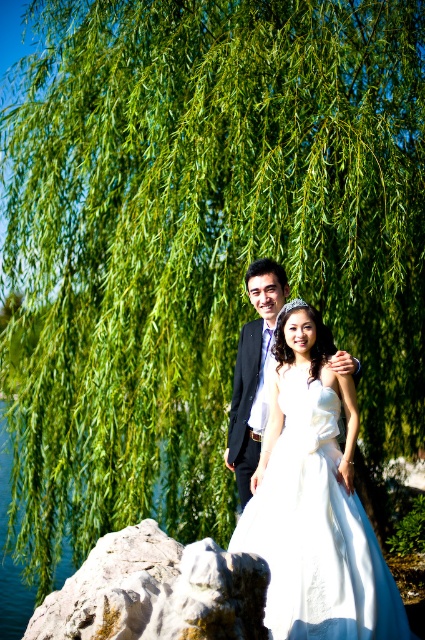
Is point (178, 637) closer to viewer compared to point (238, 476)?

That is True.

Does rough textured rock at lower left appear on the left side of matte black suit at center?

Indeed, rough textured rock at lower left is positioned on the left side of matte black suit at center.

The width and height of the screenshot is (425, 640). I want to click on rough textured rock at lower left, so click(155, 592).

The image size is (425, 640). I want to click on rough textured rock at lower left, so click(x=155, y=592).

Does white satin dress at center have a lesser width compared to matte black suit at center?

In fact, white satin dress at center might be wider than matte black suit at center.

Which is behind, point (291, 529) or point (257, 321)?

The point (257, 321) is more distant.

Where is `white satin dress at center`? white satin dress at center is located at coordinates (316, 531).

Can you confirm if white satin dress at center is smaller than rough textured rock at lower left?

Yes.

Who is positioned more to the left, white satin dress at center or rough textured rock at lower left?

Positioned to the left is rough textured rock at lower left.

In order to click on white satin dress at center in this screenshot , I will do `click(316, 531)`.